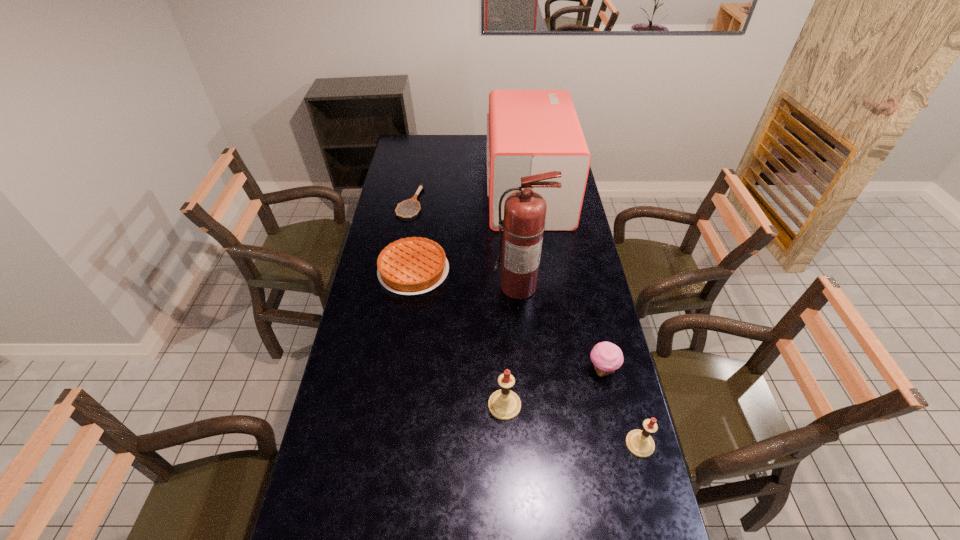
Please point a spot to add another candle on the left. Please provide its 2D coordinates. Your answer should be formatted as a tuple, i.e. [(x, y)], where the tuple contains the x and y coordinates of a point satisfying the conditions above.

[(385, 371)]